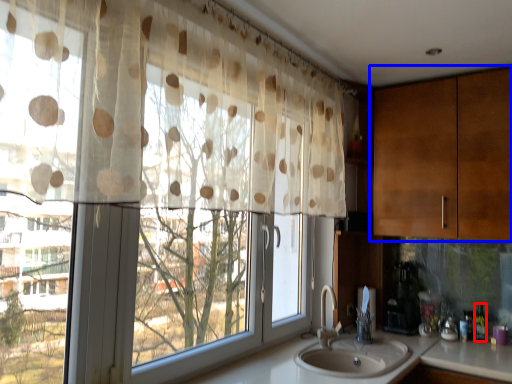
Question: Among these objects, which one is farthest to the camera, bottle (highlighted by a red box) or cabinetry (highlighted by a blue box)?

Choices:
 (A) bottle
 (B) cabinetry

Answer: (A)